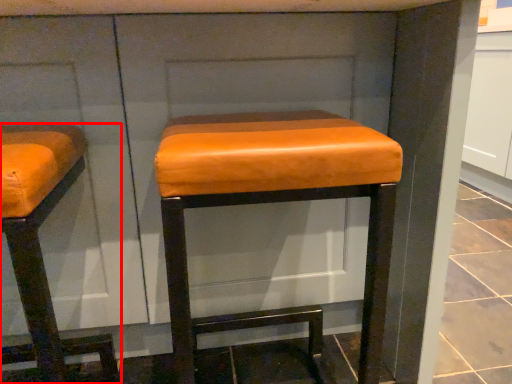
Question: From the image's perspective, what is the correct spatial positioning of furniture (annotated by the red box) in reference to stool?

Choices:
 (A) above
 (B) below

Answer: (B)